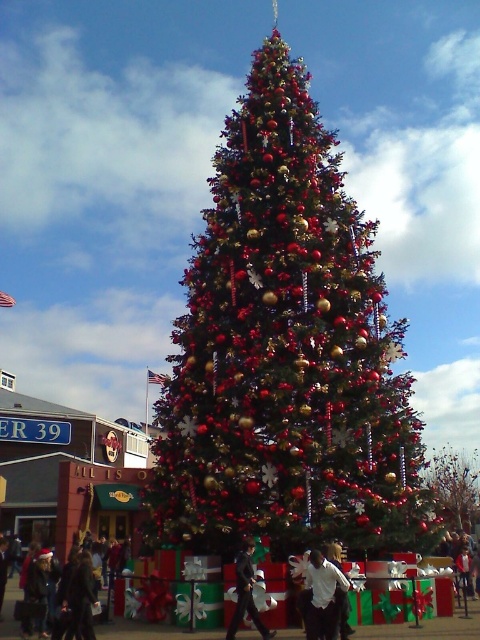
Is dark gray suit at center smaller than white cotton shirt at center?

Yes, dark gray suit at center is smaller than white cotton shirt at center.

Is dark gray suit at center taller than white cotton shirt at center?

Indeed, dark gray suit at center has a greater height compared to white cotton shirt at center.

Is point (342, 630) behind point (466, 560)?

That is False.

Find the location of a particular element. dark gray suit at center is located at coordinates (343, 614).

Can you confirm if shiny red ornaments at center is positioned to the right of black suit at center?

Correct, you'll find shiny red ornaments at center to the right of black suit at center.

You are a GUI agent. You are given a task and a screenshot of the screen. Output one action in this format:
    pyautogui.click(x=<x>, y=<y>)
    Task: Click on the shiny red ornaments at center
    This screenshot has width=480, height=640.
    Given the screenshot: What is the action you would take?
    pyautogui.click(x=455, y=484)

Does white matte shirt at center appear on the left side of dark gray suit at center?

Correct, you'll find white matte shirt at center to the left of dark gray suit at center.

Is white matte shirt at center bigger than dark gray suit at center?

Indeed, white matte shirt at center has a larger size compared to dark gray suit at center.

Between point (312, 577) and point (344, 611), which one is positioned in front?

Point (344, 611) is in front.

Find the location of a particular element. The image size is (480, 640). white matte shirt at center is located at coordinates (322, 596).